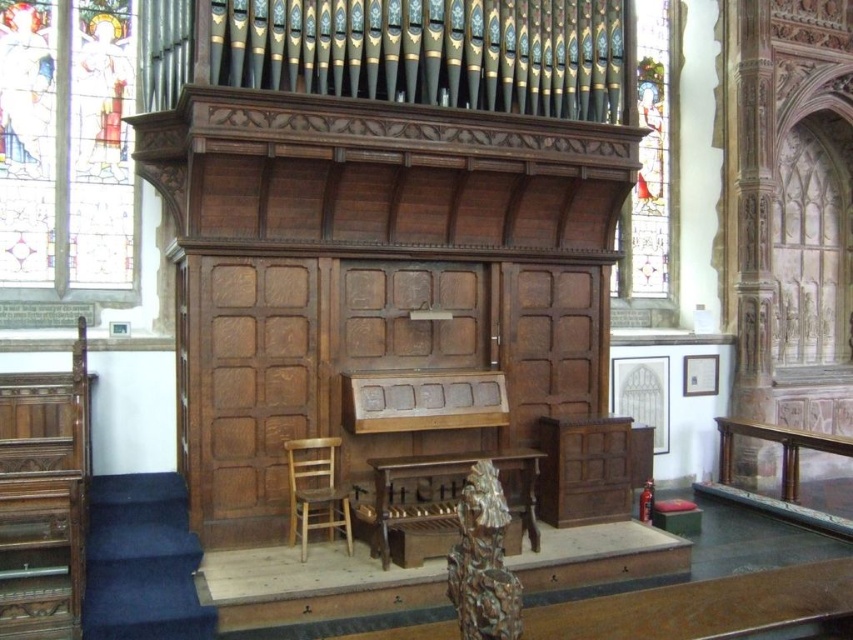
Based on the photo, you are standing in the church and want to move from the wooden chair at lower left to the stained glass window at upper right. Which direction should you move in?

The wooden chair at lower left is behind the stained glass window at upper right, so you should move forward towards the stained glass window at upper right to reach it.

You are an interior designer planning to place a new decorative item between the wooden altar at center and the wooden chair at lower left. Which object should you consider the width of to ensure the item fits properly?

The wooden altar at center has a larger width than the wooden chair at lower left. Therefore, you should consider the width of the wooden altar at center to ensure the decorative item fits properly between them.

Based on the scene description, where is the stained glass window at upper right located in terms of coordinates?

The stained glass window at upper right is located at coordinates point (648, 161).